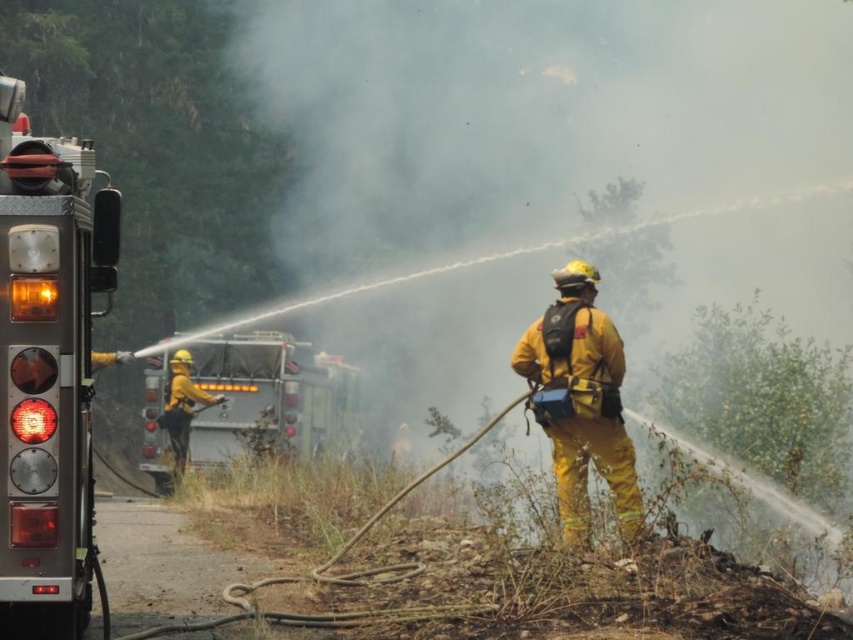
Is brushed metal fire truck at center-left behind yellow matte fireman at left?

Yes, brushed metal fire truck at center-left is behind yellow matte fireman at left.

Is point (300, 422) more distant than point (175, 419)?

Yes, point (300, 422) is behind point (175, 419).

In order to click on brushed metal fire truck at center-left in this screenshot , I will do 270,397.

The height and width of the screenshot is (640, 853). What do you see at coordinates (49, 365) in the screenshot? I see `metallic silver fire truck at left` at bounding box center [49, 365].

Does metallic silver fire truck at left appear on the right side of brushed metal fire truck at center-left?

Indeed, metallic silver fire truck at left is positioned on the right side of brushed metal fire truck at center-left.

I want to click on metallic silver fire truck at left, so click(x=49, y=365).

Who is shorter, yellow fireproof suit at center or yellow matte fireman at left?

With less height is yellow fireproof suit at center.

Looking at this image, can you confirm if yellow fireproof suit at center is taller than yellow matte fireman at left?

No.

Is point (531, 355) closer to viewer compared to point (186, 435)?

That is True.

The width and height of the screenshot is (853, 640). What are the coordinates of `yellow fireproof suit at center` in the screenshot? It's located at (x=581, y=401).